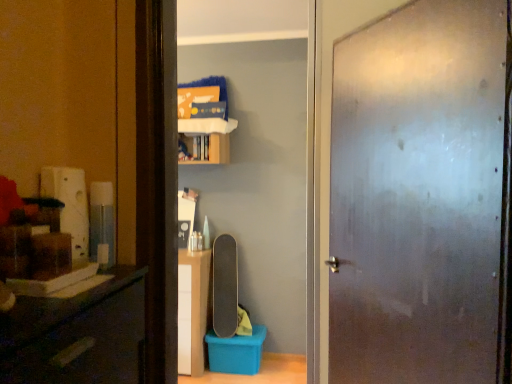
Question: Is smooth black skateboard at center to the left of wooden cabinet at upper center from the viewer's perspective?

Choices:
 (A) no
 (B) yes

Answer: (A)

Question: Considering the relative sizes of smooth black skateboard at center and wooden cabinet at upper center in the image provided, is smooth black skateboard at center bigger than wooden cabinet at upper center?

Choices:
 (A) yes
 (B) no

Answer: (B)

Question: From a real-world perspective, does smooth black skateboard at center stand above wooden cabinet at upper center?

Choices:
 (A) no
 (B) yes

Answer: (A)

Question: Is smooth black skateboard at center next to wooden cabinet at upper center?

Choices:
 (A) no
 (B) yes

Answer: (A)

Question: Is smooth black skateboard at center at the right side of wooden cabinet at upper center?

Choices:
 (A) no
 (B) yes

Answer: (B)

Question: In terms of size, does smooth black skateboard at center appear bigger or smaller than wooden cabinet at upper center?

Choices:
 (A) small
 (B) big

Answer: (A)

Question: In terms of width, does smooth black skateboard at center look wider or thinner when compared to wooden cabinet at upper center?

Choices:
 (A) wide
 (B) thin

Answer: (B)

Question: From the image's perspective, relative to wooden cabinet at upper center, is smooth black skateboard at center above or below?

Choices:
 (A) below
 (B) above

Answer: (A)

Question: Relative to wooden cabinet at upper center, is smooth black skateboard at center in front or behind?

Choices:
 (A) behind
 (B) front

Answer: (A)

Question: Is frosted glass door at center taller or shorter than smooth black skateboard at center?

Choices:
 (A) tall
 (B) short

Answer: (A)

Question: From a real-world perspective, is frosted glass door at center above or below smooth black skateboard at center?

Choices:
 (A) below
 (B) above

Answer: (B)

Question: Considering the relative positions of frosted glass door at center and smooth black skateboard at center in the image provided, is frosted glass door at center to the left or to the right of smooth black skateboard at center?

Choices:
 (A) right
 (B) left

Answer: (A)

Question: Is point (502, 26) positioned closer to the camera than point (237, 268)?

Choices:
 (A) closer
 (B) farther

Answer: (A)

Question: Is smooth black skateboard at center bigger or smaller than frosted glass door at center?

Choices:
 (A) small
 (B) big

Answer: (A)

Question: From the image's perspective, is smooth black skateboard at center located above or below frosted glass door at center?

Choices:
 (A) below
 (B) above

Answer: (A)